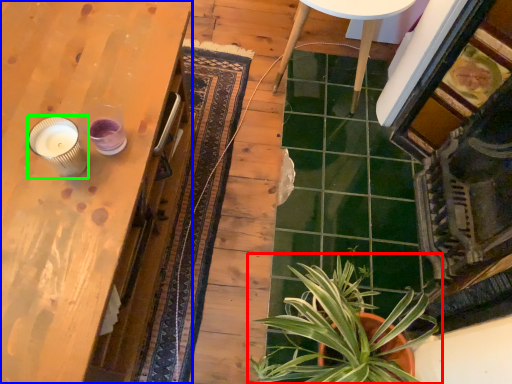
Question: Which object is positioned farthest from houseplant (highlighted by a red box)? Select from table (highlighted by a blue box) and candle holder (highlighted by a green box).

Choices:
 (A) table
 (B) candle holder

Answer: (B)